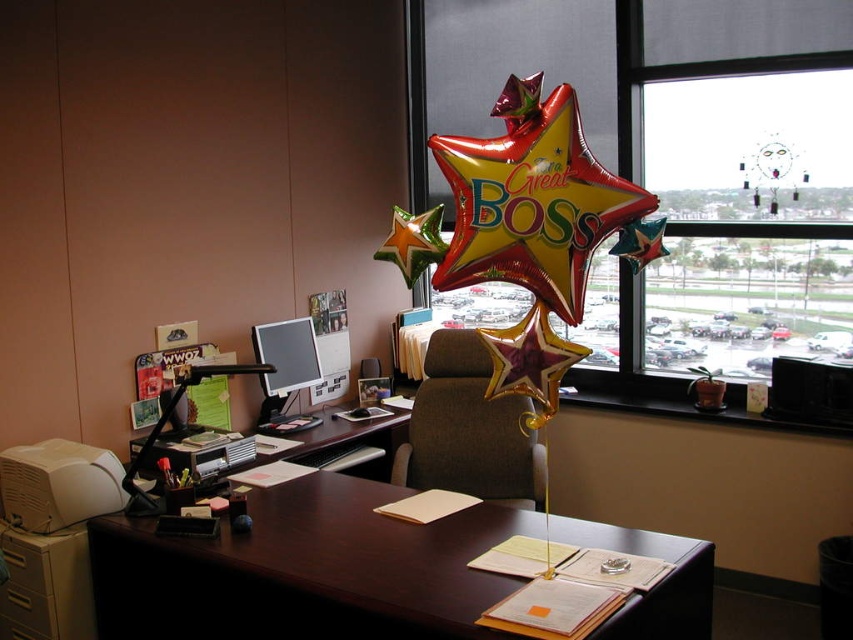
Question: Does dark wood desk at center come behind transparent glass window at upper center?

Choices:
 (A) yes
 (B) no

Answer: (B)

Question: Which object is positioned closest to the matte black monitor at center?

Choices:
 (A) transparent glass window at upper center
 (B) brown wood computer desk at center

Answer: (B)

Question: Is dark wood desk at center to the right of matte black monitor at center from the viewer's perspective?

Choices:
 (A) yes
 (B) no

Answer: (A)

Question: Which object is farther from the camera taking this photo?

Choices:
 (A) matte brown swivel chair at center
 (B) transparent glass window at upper center

Answer: (B)

Question: Which of the following is the farthest from the observer?

Choices:
 (A) (283, 385)
 (B) (531, 499)

Answer: (A)

Question: Observing the image, what is the correct spatial positioning of dark wood desk at center in reference to matte brown swivel chair at center?

Choices:
 (A) left
 (B) right

Answer: (A)